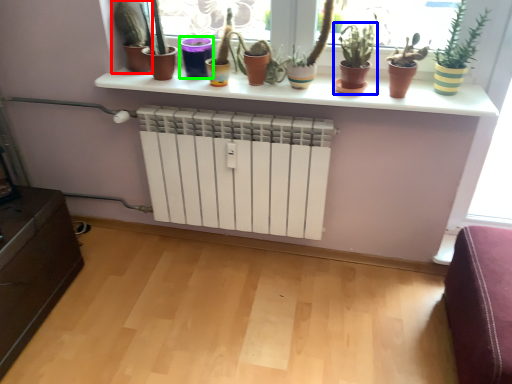
Question: Which object is the farthest from houseplant (highlighted by a red box)? Choose among these: houseplant (highlighted by a blue box) or vase (highlighted by a green box).

Choices:
 (A) houseplant
 (B) vase

Answer: (A)